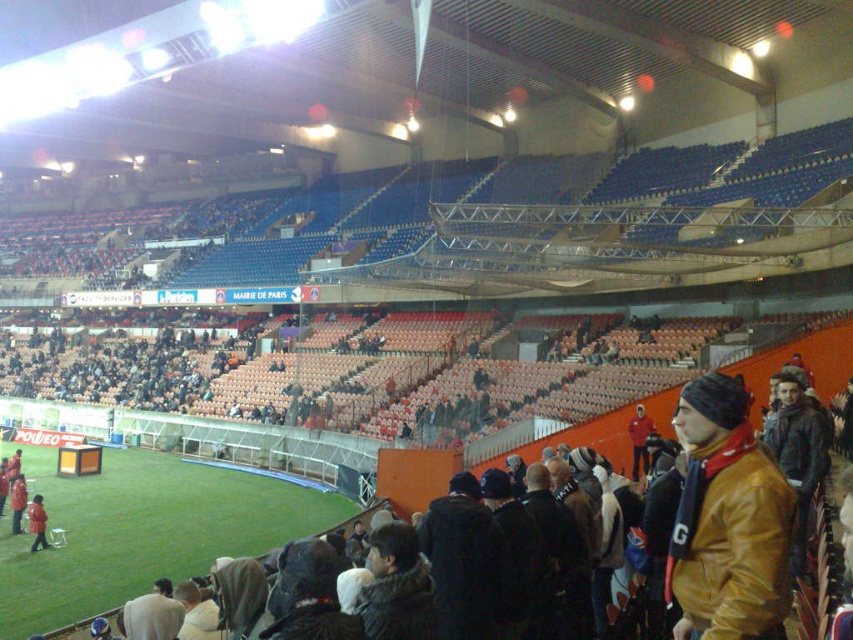
You are a spectator at the stadium and you see two jackets on the seats in front of you. The jackets are the brown leather jacket at lower right and the red fabric jacket at right. Which jacket takes up more space on the seat?

The brown leather jacket at lower right is bigger than the red fabric jacket at right, so it takes up more space on the seat.

You are a spectator at the stadium and you want to locate the red fabric jacket at right and the orange fabric jacket at lower left. Which jacket is bigger in size?

The red fabric jacket at right is larger in size compared to the orange fabric jacket at lower left.